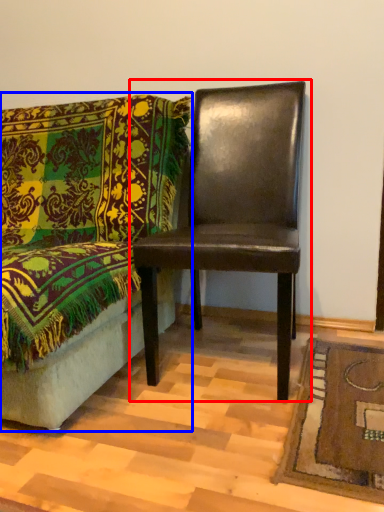
Question: Which point is further to the camera, chair (highlighted by a red box) or chair (highlighted by a blue box)?

Choices:
 (A) chair
 (B) chair

Answer: (A)